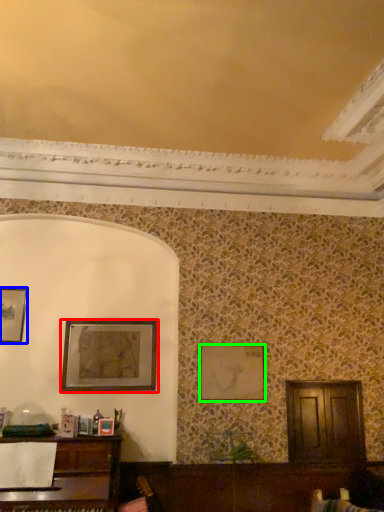
Question: Considering the real-world distances, which object is farthest from picture frame (highlighted by a red box)? picture frame (highlighted by a blue box) or picture frame (highlighted by a green box)?

Choices:
 (A) picture frame
 (B) picture frame

Answer: (B)